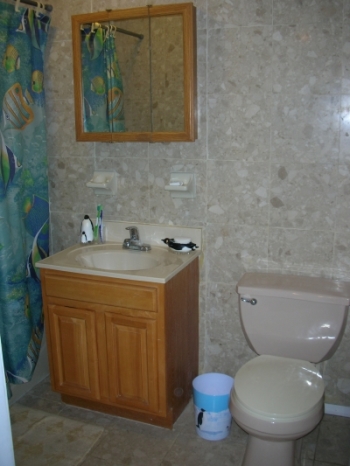
Image resolution: width=350 pixels, height=466 pixels. In order to click on faucet in this screenshot , I will do `click(126, 244)`.